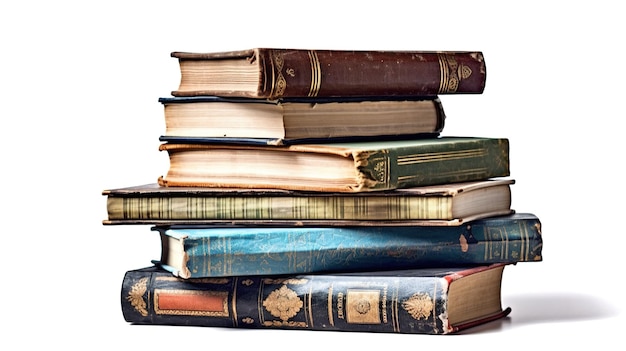
This screenshot has height=351, width=626. What are the coordinates of `older books` in the screenshot? It's located at (326, 78), (315, 111), (385, 167), (385, 204), (376, 239), (335, 295).